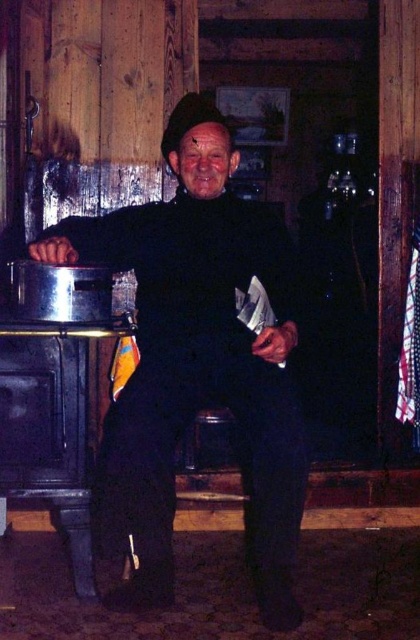
Question: Which of the following is the closest to the observer?

Choices:
 (A) (76, 326)
 (B) (100, 300)

Answer: (A)

Question: In this image, where is metallic silver pot at left located relative to brushed metal pot at left?

Choices:
 (A) above
 (B) below

Answer: (A)

Question: Is black matte jacket at center to the right of black matte oven at left from the viewer's perspective?

Choices:
 (A) yes
 (B) no

Answer: (A)

Question: Does black matte jacket at center appear on the left side of black matte oven at left?

Choices:
 (A) yes
 (B) no

Answer: (B)

Question: Which point appears farthest from the camera in this image?

Choices:
 (A) (55, 330)
 (B) (149, 216)
 (C) (76, 445)

Answer: (B)

Question: Estimate the real-world distances between objects in this image. Which object is closer to the brushed metal pot at left?

Choices:
 (A) black matte jacket at center
 (B) black matte oven at left
 (C) metallic silver pot at left

Answer: (C)